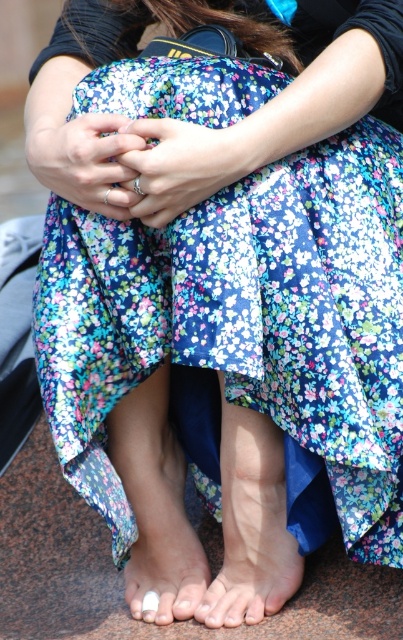
What is located at the point with coordinates (243, 323) in the image?

The point at coordinates (243, 323) is occupied by the floral fabric dress at center.

You are taking a photo of the person sitting on the stone surface. You want to focus on the point closer to the camera. Which point should you choose between point (282,532) and point (141,534)?

You should focus on point (282,532) because it is closer to the camera than point (141,534).

You are a tailor measuring the distance between the floral fabric dress at center and the white matte nail at center for a custom alteration. Given that the minimum required space for the alteration is 20 inches, can the alteration be done?

The floral fabric dress at center and white matte nail at center are 21.10 inches apart from each other, which exceeds the minimum required space of 20 inches. Therefore, the alteration can be done.